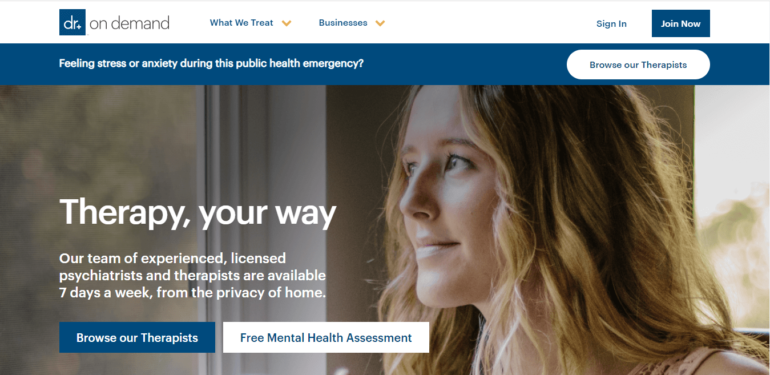
This screenshot has height=375, width=770. I want to click on white wall, so click(x=316, y=159).